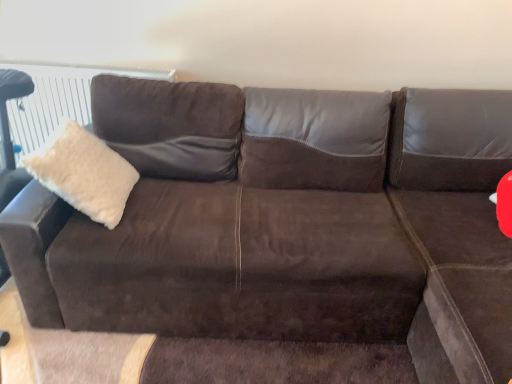
Describe the element at coordinates (83, 172) in the screenshot. This screenshot has height=384, width=512. I see `white fluffy pillow at left` at that location.

What are the coordinates of `white fluffy pillow at left` in the screenshot? It's located at (83, 172).

In order to click on white fluffy pillow at left in this screenshot , I will do tap(83, 172).